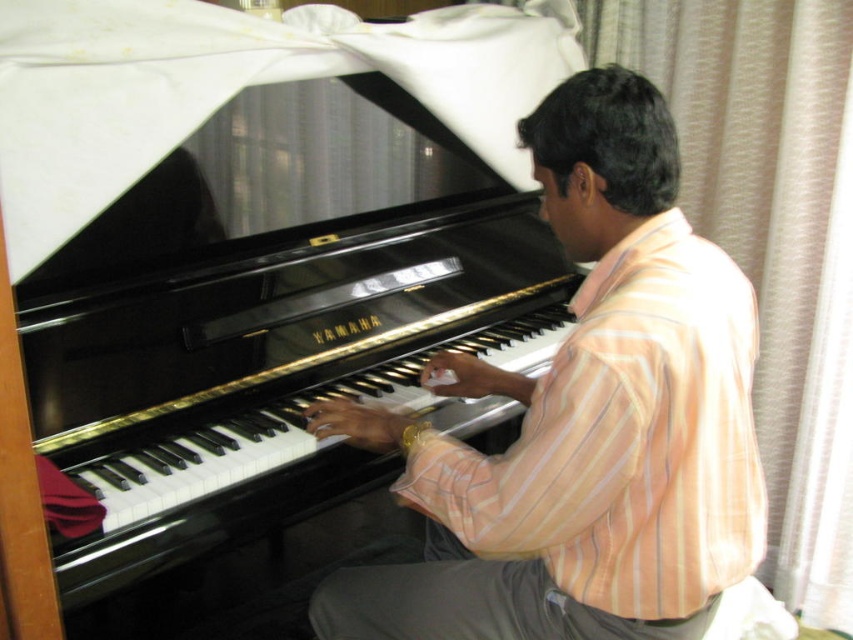
Between striped cotton shirt at center and black polished piano at center, which one appears on the left side from the viewer's perspective?

Positioned to the left is black polished piano at center.

Describe the element at coordinates (584, 420) in the screenshot. This screenshot has width=853, height=640. I see `striped cotton shirt at center` at that location.

Is point (672, 525) closer to viewer compared to point (202, 528)?

Yes, point (672, 525) is closer to viewer.

Where is `striped cotton shirt at center`? The width and height of the screenshot is (853, 640). striped cotton shirt at center is located at coordinates (584, 420).